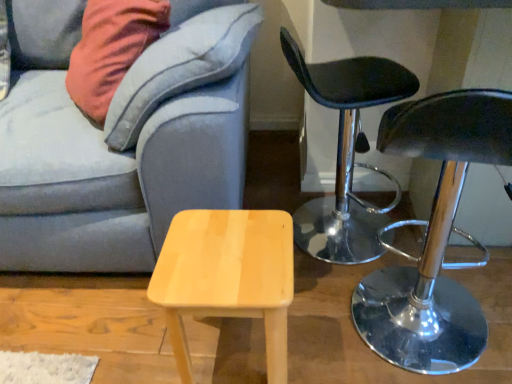
This screenshot has height=384, width=512. What do you see at coordinates (227, 276) in the screenshot?
I see `light wood stool at center` at bounding box center [227, 276].

This screenshot has width=512, height=384. Describe the element at coordinates (120, 139) in the screenshot. I see `velvet gray couch at lower left` at that location.

Identify the location of shiny chrome stool at right, which is counted as the 1th chair, starting from the front. (434, 235).

Could you tell me if black leather stool at right, which ranks as the first chair in back-to-front order, is facing shiny chrome stool at right, which is counted as the 1th chair, starting from the front?

No, black leather stool at right, which ranks as the first chair in back-to-front order, is not oriented towards shiny chrome stool at right, which is counted as the 1th chair, starting from the front.

Is black leather stool at right, which is counted as the 2th chair, starting from the front, inside or outside of shiny chrome stool at right, which is counted as the 1th chair, starting from the front?

black leather stool at right, which is counted as the 2th chair, starting from the front, exists outside the volume of shiny chrome stool at right, which is counted as the 1th chair, starting from the front.

Where is `chair located above the shiny chrome stool at right, which ranks as the second chair in back-to-front order (from the image's perspective)`? This screenshot has width=512, height=384. chair located above the shiny chrome stool at right, which ranks as the second chair in back-to-front order (from the image's perspective) is located at coordinates click(x=346, y=153).

Consider the image. Between shiny chrome stool at right, which ranks as the second chair in back-to-front order, and black leather stool at right, which ranks as the first chair in back-to-front order, which one appears on the left side from the viewer's perspective?

Positioned to the left is black leather stool at right, which ranks as the first chair in back-to-front order.

From the image's perspective, who appears lower, shiny chrome stool at right, which ranks as the second chair in back-to-front order, or black leather stool at right, which ranks as the first chair in back-to-front order?

shiny chrome stool at right, which ranks as the second chair in back-to-front order, from the image's perspective.

From a real-world perspective, which is physically above, shiny chrome stool at right, which is counted as the 1th chair, starting from the front, or black leather stool at right, which is counted as the 2th chair, starting from the front?

shiny chrome stool at right, which is counted as the 1th chair, starting from the front, from a real-world perspective.

Would you say shiny chrome stool at right, which is counted as the 1th chair, starting from the front, is inside or outside black leather stool at right, which ranks as the first chair in back-to-front order?

shiny chrome stool at right, which is counted as the 1th chair, starting from the front, is not enclosed by black leather stool at right, which ranks as the first chair in back-to-front order.

Can you tell me how much light wood stool at center and shiny chrome stool at right, which is counted as the 1th chair, starting from the front, differ in facing direction?

The angle between the facing direction of light wood stool at center and the facing direction of shiny chrome stool at right, which is counted as the 1th chair, starting from the front, is 178 degrees.

Is point (215, 275) positioned before point (383, 306)?

Yes, point (215, 275) is closer to viewer.

Is light wood stool at center oriented away from shiny chrome stool at right, which ranks as the second chair in back-to-front order?

No, light wood stool at center is not facing the opposite direction of shiny chrome stool at right, which ranks as the second chair in back-to-front order.

What's the angular difference between black leather stool at right, which is counted as the 2th chair, starting from the front, and velvet gray couch at lower left's facing directions?

black leather stool at right, which is counted as the 2th chair, starting from the front, and velvet gray couch at lower left are facing 86.4 degrees away from each other.

Relative to velvet gray couch at lower left, is black leather stool at right, which ranks as the first chair in back-to-front order, in front or behind?

In the image, black leather stool at right, which ranks as the first chair in back-to-front order, appears behind velvet gray couch at lower left.

Is black leather stool at right, which is counted as the 2th chair, starting from the front, looking in the opposite direction of velvet gray couch at lower left?

Yes, black leather stool at right, which is counted as the 2th chair, starting from the front, is facing away from velvet gray couch at lower left.

From the image's perspective, is black leather stool at right, which ranks as the first chair in back-to-front order, above or below velvet gray couch at lower left?

Clearly, from the image's perspective, black leather stool at right, which ranks as the first chair in back-to-front order, is below velvet gray couch at lower left.

Is velvet gray couch at lower left with light wood stool at center?

velvet gray couch at lower left is not next to light wood stool at center, and they're not touching.

Could you tell me if velvet gray couch at lower left is turned towards light wood stool at center?

Yes, velvet gray couch at lower left is turned towards light wood stool at center.

Considering the points (105, 217) and (256, 211), which point is behind, point (105, 217) or point (256, 211)?

The point (105, 217) is behind.

Considering the relative sizes of velvet gray couch at lower left and shiny chrome stool at right, which ranks as the second chair in back-to-front order, in the image provided, is velvet gray couch at lower left bigger than shiny chrome stool at right, which ranks as the second chair in back-to-front order,?

Yes, velvet gray couch at lower left is bigger than shiny chrome stool at right, which ranks as the second chair in back-to-front order.

Considering the points (14, 35) and (455, 230), which point is behind, point (14, 35) or point (455, 230)?

The point (14, 35) is farther from the camera.

Would you say velvet gray couch at lower left is inside or outside shiny chrome stool at right, which ranks as the second chair in back-to-front order?

velvet gray couch at lower left is not enclosed by shiny chrome stool at right, which ranks as the second chair in back-to-front order.

Looking at their sizes, would you say velvet gray couch at lower left is wider or thinner than shiny chrome stool at right, which is counted as the 1th chair, starting from the front?

velvet gray couch at lower left is wider than shiny chrome stool at right, which is counted as the 1th chair, starting from the front.

Between black leather stool at right, which is counted as the 2th chair, starting from the front, and light wood stool at center, which one has less height?

light wood stool at center is shorter.

Measure the distance from black leather stool at right, which ranks as the first chair in back-to-front order, to light wood stool at center.

20.56 inches.

From a real-world perspective, is black leather stool at right, which ranks as the first chair in back-to-front order, under light wood stool at center?

No, from a real-world perspective, black leather stool at right, which ranks as the first chair in back-to-front order, is not under light wood stool at center.

Where is `chair below the shiny chrome stool at right, which ranks as the second chair in back-to-front order (from a real-world perspective)`? chair below the shiny chrome stool at right, which ranks as the second chair in back-to-front order (from a real-world perspective) is located at coordinates (346, 153).

Where is `chair that is in front of the black leather stool at right, which is counted as the 2th chair, starting from the front`? chair that is in front of the black leather stool at right, which is counted as the 2th chair, starting from the front is located at coordinates (434, 235).

When comparing their distances from light wood stool at center, does velvet gray couch at lower left or black leather stool at right, which is counted as the 2th chair, starting from the front, seem further?

The object further to light wood stool at center is black leather stool at right, which is counted as the 2th chair, starting from the front.

From the picture: When comparing their distances from shiny chrome stool at right, which ranks as the second chair in back-to-front order, does velvet gray couch at lower left or light wood stool at center seem further?

Based on the image, velvet gray couch at lower left appears to be further to shiny chrome stool at right, which ranks as the second chair in back-to-front order.

Which object lies further to the anchor point black leather stool at right, which is counted as the 2th chair, starting from the front, velvet gray couch at lower left or shiny chrome stool at right, which is counted as the 1th chair, starting from the front?

velvet gray couch at lower left lies further to black leather stool at right, which is counted as the 2th chair, starting from the front, than the other object.

From the image, which object appears to be nearer to shiny chrome stool at right, which is counted as the 1th chair, starting from the front, light wood stool at center or black leather stool at right, which is counted as the 2th chair, starting from the front?

The object closer to shiny chrome stool at right, which is counted as the 1th chair, starting from the front, is black leather stool at right, which is counted as the 2th chair, starting from the front.

Estimate the real-world distances between objects in this image. Which object is further from velvet gray couch at lower left, light wood stool at center or shiny chrome stool at right, which ranks as the second chair in back-to-front order?

shiny chrome stool at right, which ranks as the second chair in back-to-front order, is positioned further to the anchor velvet gray couch at lower left.

Which object lies further to the anchor point shiny chrome stool at right, which ranks as the second chair in back-to-front order, velvet gray couch at lower left or black leather stool at right, which is counted as the 2th chair, starting from the front?

velvet gray couch at lower left.

Which object lies further to the anchor point shiny chrome stool at right, which is counted as the 1th chair, starting from the front, light wood stool at center or velvet gray couch at lower left?

velvet gray couch at lower left.

When comparing their distances from light wood stool at center, does black leather stool at right, which ranks as the first chair in back-to-front order, or velvet gray couch at lower left seem closer?

velvet gray couch at lower left.

This screenshot has height=384, width=512. What are the coordinates of `stool between velvet gray couch at lower left and shiny chrome stool at right, which ranks as the second chair in back-to-front order, from left to right` in the screenshot? It's located at (227, 276).

This screenshot has width=512, height=384. Find the location of `chair between velvet gray couch at lower left and shiny chrome stool at right, which ranks as the second chair in back-to-front order, from left to right`. chair between velvet gray couch at lower left and shiny chrome stool at right, which ranks as the second chair in back-to-front order, from left to right is located at coordinates (346, 153).

The height and width of the screenshot is (384, 512). I want to click on stool between velvet gray couch at lower left and black leather stool at right, which is counted as the 2th chair, starting from the front, in the horizontal direction, so click(227, 276).

You are a GUI agent. You are given a task and a screenshot of the screen. Output one action in this format:
    pyautogui.click(x=<x>, y=<y>)
    Task: Click on the chair between light wood stool at center and shiny chrome stool at right, which ranks as the second chair in back-to-front order, from left to right
    The height and width of the screenshot is (384, 512).
    Given the screenshot: What is the action you would take?
    pyautogui.click(x=346, y=153)